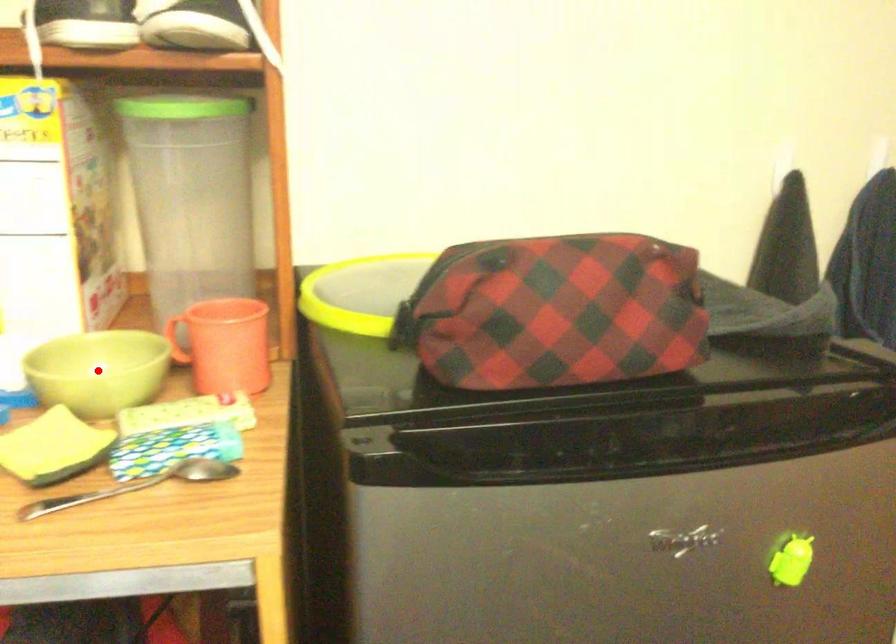
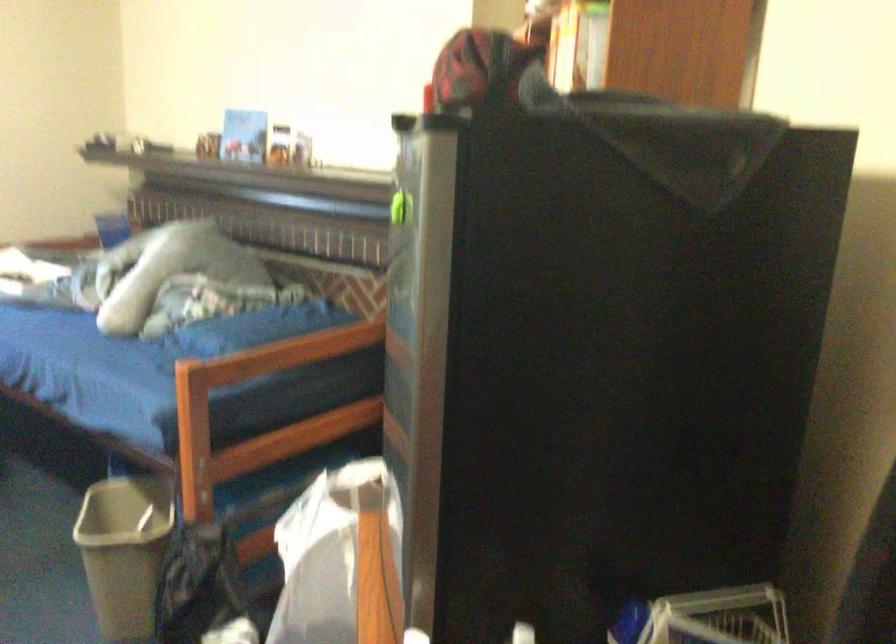
Question: I am providing you with two images of the same scene from different viewpoints. A red point is marked on the first image. Can you still see the location of the red point in image 2?

Choices:
 (A) Yes
 (B) No

Answer: (B)